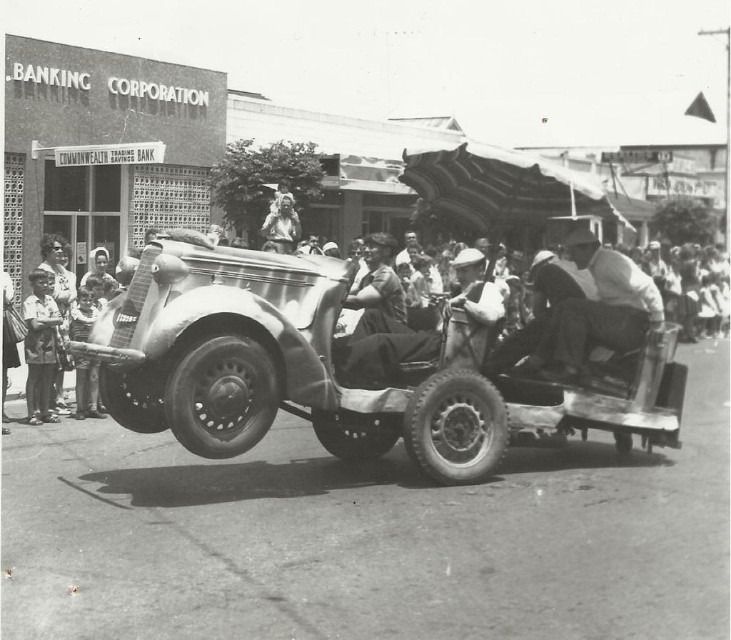
Question: Can you confirm if polished chrome car at center is thinner than smooth fabric doll at center?

Choices:
 (A) yes
 (B) no

Answer: (B)

Question: Does light brown fabric child at lower left appear over matte black dress at center?

Choices:
 (A) yes
 (B) no

Answer: (B)

Question: Can you confirm if plaid fabric shirt at center is positioned above light brown fabric child at lower left?

Choices:
 (A) no
 (B) yes

Answer: (B)

Question: Which of the following is the farthest from the observer?

Choices:
 (A) (34, 321)
 (B) (572, 332)

Answer: (A)

Question: Which object is farther from the camera taking this photo?

Choices:
 (A) smooth fabric doll at center
 (B) smooth leather jacket at center
 (C) plaid fabric shirt at center
 (D) polished chrome car at center

Answer: (A)

Question: Which is farther from the smooth leather jacket at center?

Choices:
 (A) light brown fabric child at lower left
 (B) polished chrome car at center

Answer: (A)